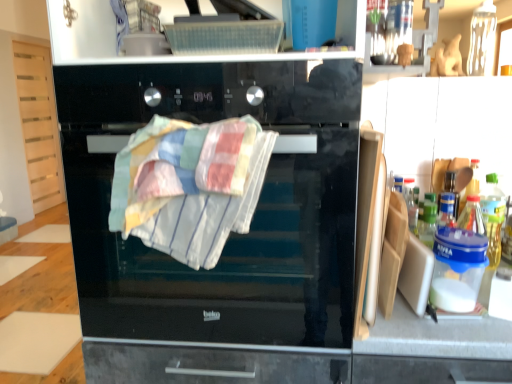
Question: Considering the relative sizes of multicolored woven towel at center and translucent plastic bottle at right in the image provided, is multicolored woven towel at center taller than translucent plastic bottle at right?

Choices:
 (A) yes
 (B) no

Answer: (A)

Question: From the image's perspective, is multicolored woven towel at center on top of translucent plastic bottle at right?

Choices:
 (A) yes
 (B) no

Answer: (A)

Question: From a real-world perspective, does multicolored woven towel at center stand above translucent plastic bottle at right?

Choices:
 (A) yes
 (B) no

Answer: (A)

Question: Is multicolored woven towel at center next to translucent plastic bottle at right?

Choices:
 (A) yes
 (B) no

Answer: (B)

Question: Can you confirm if multicolored woven towel at center is bigger than translucent plastic bottle at right?

Choices:
 (A) no
 (B) yes

Answer: (B)

Question: Can you confirm if multicolored woven towel at center is positioned to the right of translucent plastic bottle at right?

Choices:
 (A) no
 (B) yes

Answer: (A)

Question: Considering the relative positions of translucent plastic bottle at right and multicolored woven towel at center in the image provided, is translucent plastic bottle at right in front of multicolored woven towel at center?

Choices:
 (A) no
 (B) yes

Answer: (A)

Question: Can you confirm if translucent plastic bottle at right is taller than multicolored woven towel at center?

Choices:
 (A) yes
 (B) no

Answer: (B)

Question: Does translucent plastic bottle at right appear on the right side of multicolored woven towel at center?

Choices:
 (A) yes
 (B) no

Answer: (A)

Question: Can you confirm if translucent plastic bottle at right is shorter than multicolored woven towel at center?

Choices:
 (A) yes
 (B) no

Answer: (A)

Question: Can we say translucent plastic bottle at right lies outside multicolored woven towel at center?

Choices:
 (A) no
 (B) yes

Answer: (B)

Question: Can you confirm if translucent plastic bottle at right is smaller than multicolored woven towel at center?

Choices:
 (A) no
 (B) yes

Answer: (B)

Question: Considering the relative sizes of multicolored woven towel at center and black glass oven at center in the image provided, is multicolored woven towel at center taller than black glass oven at center?

Choices:
 (A) yes
 (B) no

Answer: (B)